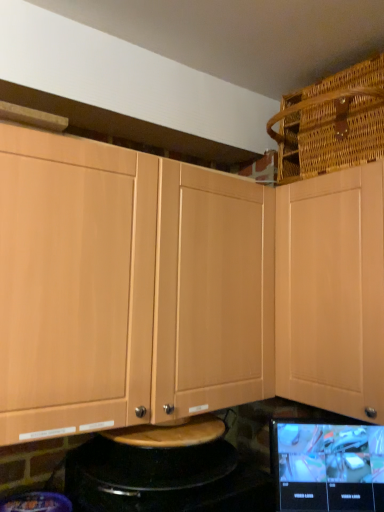
Question: Is light wood cabinet at upper left, which appears as the 2th cabinetry when viewed from the right, wider than woven brown basket at upper right?

Choices:
 (A) no
 (B) yes

Answer: (A)

Question: Is light wood cabinet at upper left, placed as the 1th cabinetry when sorted from left to right, closer to camera compared to woven brown basket at upper right?

Choices:
 (A) yes
 (B) no

Answer: (A)

Question: Does light wood cabinet at upper left, placed as the 1th cabinetry when sorted from left to right, have a lesser height compared to woven brown basket at upper right?

Choices:
 (A) no
 (B) yes

Answer: (A)

Question: From a real-world perspective, is light wood cabinet at upper left, which appears as the 2th cabinetry when viewed from the right, beneath woven brown basket at upper right?

Choices:
 (A) no
 (B) yes

Answer: (B)

Question: Is light wood cabinet at upper left, placed as the 1th cabinetry when sorted from left to right, turned away from woven brown basket at upper right?

Choices:
 (A) yes
 (B) no

Answer: (B)

Question: From the image's perspective, does light wood cabinet at upper left, placed as the 1th cabinetry when sorted from left to right, appear lower than woven brown basket at upper right?

Choices:
 (A) no
 (B) yes

Answer: (B)

Question: Is light wood cabinet at upper right, which ranks as the 2th cabinetry in left-to-right order, closer to the viewer compared to light wood cabinet at upper left, placed as the 1th cabinetry when sorted from left to right?

Choices:
 (A) yes
 (B) no

Answer: (B)

Question: Is light wood cabinet at upper right, which ranks as the 2th cabinetry in left-to-right order, turned away from light wood cabinet at upper left, which appears as the 2th cabinetry when viewed from the right?

Choices:
 (A) yes
 (B) no

Answer: (B)

Question: Is light wood cabinet at upper right, which ranks as the 2th cabinetry in left-to-right order, bigger than light wood cabinet at upper left, placed as the 1th cabinetry when sorted from left to right?

Choices:
 (A) no
 (B) yes

Answer: (A)

Question: Does light wood cabinet at upper right, which ranks as the 2th cabinetry in left-to-right order, appear on the right side of light wood cabinet at upper left, which appears as the 2th cabinetry when viewed from the right?

Choices:
 (A) yes
 (B) no

Answer: (A)

Question: From a real-world perspective, is light wood cabinet at upper right, positioned as the 1th cabinetry in right-to-left order, located higher than light wood cabinet at upper left, which appears as the 2th cabinetry when viewed from the right?

Choices:
 (A) no
 (B) yes

Answer: (B)

Question: Is light wood cabinet at upper right, which ranks as the 2th cabinetry in left-to-right order, further to the viewer compared to light wood cabinet at upper left, which appears as the 2th cabinetry when viewed from the right?

Choices:
 (A) yes
 (B) no

Answer: (A)

Question: From the image's perspective, is light wood cabinet at upper right, positioned as the 1th cabinetry in right-to-left order, on top of matte black tablet at lower right?

Choices:
 (A) yes
 (B) no

Answer: (A)